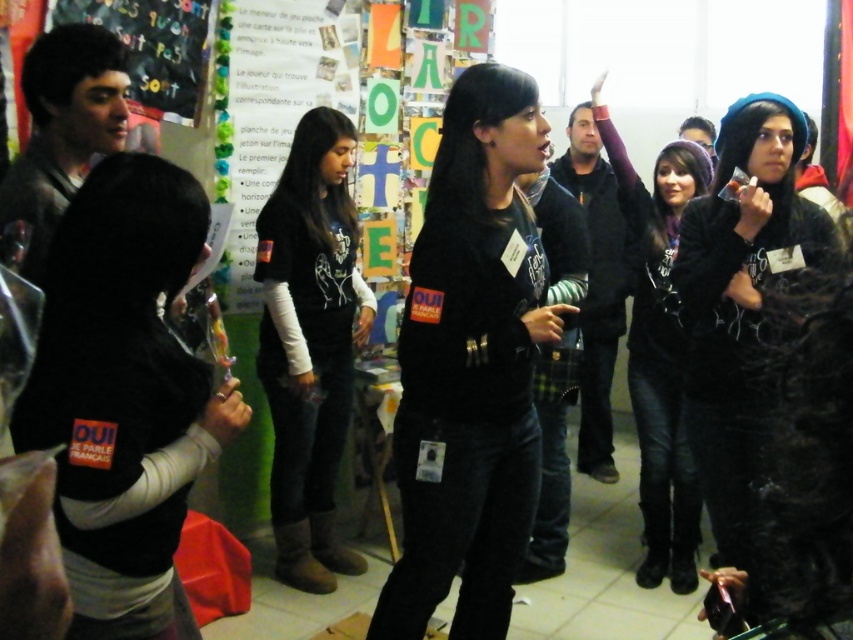
How far apart are black matte shirt at center and matte black chalkboard at upper left?

They are 1.50 meters apart.

Is black matte shirt at center closer to the viewer compared to matte black chalkboard at upper left?

Yes.

Is point (498, 579) positioned after point (178, 42)?

No, it is not.

You are a GUI agent. You are given a task and a screenshot of the screen. Output one action in this format:
    pyautogui.click(x=<x>, y=<y>)
    Task: Click on the black matte shirt at center
    
    Given the screenshot: What is the action you would take?
    pyautogui.click(x=471, y=365)

Does shiny black jacket at left have a lesser width compared to matte black chalkboard at upper left?

Indeed, shiny black jacket at left has a lesser width compared to matte black chalkboard at upper left.

Can you confirm if shiny black jacket at left is positioned below matte black chalkboard at upper left?

Yes.

Does point (44, 97) come farther from viewer compared to point (161, 92)?

That is False.

The image size is (853, 640). Identify the location of shiny black jacket at left. (64, 128).

Who is positioned more to the right, black matte vest at lower left or matte black chalkboard at upper left?

From the viewer's perspective, black matte vest at lower left appears more on the right side.

Is point (103, 557) closer to viewer compared to point (144, 4)?

Yes, it is.

Is point (175, 548) farther from camera compared to point (148, 61)?

No, it is not.

At what (x,y) coordinates should I click in order to perform the action: click on black matte vest at lower left. Please return your answer as a coordinate pair (x, y). Looking at the image, I should click on (122, 387).